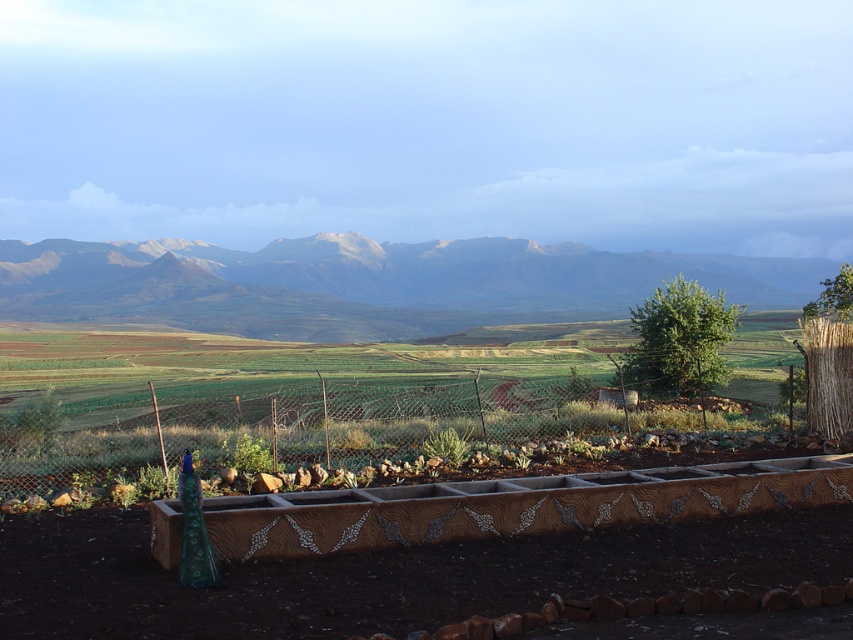
How much distance is there between metallic wire fence at lower center and gray rocky mountains at upper center?

metallic wire fence at lower center and gray rocky mountains at upper center are 54.38 meters apart from each other.

Is metallic wire fence at lower center taller than gray rocky mountains at upper center?

Incorrect, metallic wire fence at lower center's height is not larger of gray rocky mountains at upper center's.

Who is more forward, (16, 422) or (804, 276)?

Point (16, 422) is in front.

I want to click on metallic wire fence at lower center, so click(361, 436).

From the picture: Who is more distant from viewer, (x=401, y=387) or (x=436, y=451)?

Positioned behind is point (x=401, y=387).

Between metallic wire fence at lower center and green succulent at center, which one is positioned lower?

metallic wire fence at lower center is below.

Locate an element on the screen. metallic wire fence at lower center is located at coordinates (361, 436).

Is gray rocky mountains at upper center shorter than green succulent at center?

In fact, gray rocky mountains at upper center may be taller than green succulent at center.

Measure the distance between gray rocky mountains at upper center and green succulent at center.

They are 71.10 meters apart.

What do you see at coordinates (368, 284) in the screenshot? I see `gray rocky mountains at upper center` at bounding box center [368, 284].

Find the location of a particular element. The image size is (853, 640). gray rocky mountains at upper center is located at coordinates (368, 284).